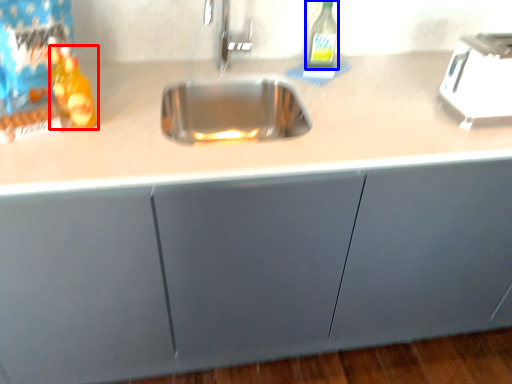
Question: Which object is further to the camera taking this photo, bottle (highlighted by a red box) or bottle (highlighted by a blue box)?

Choices:
 (A) bottle
 (B) bottle

Answer: (B)